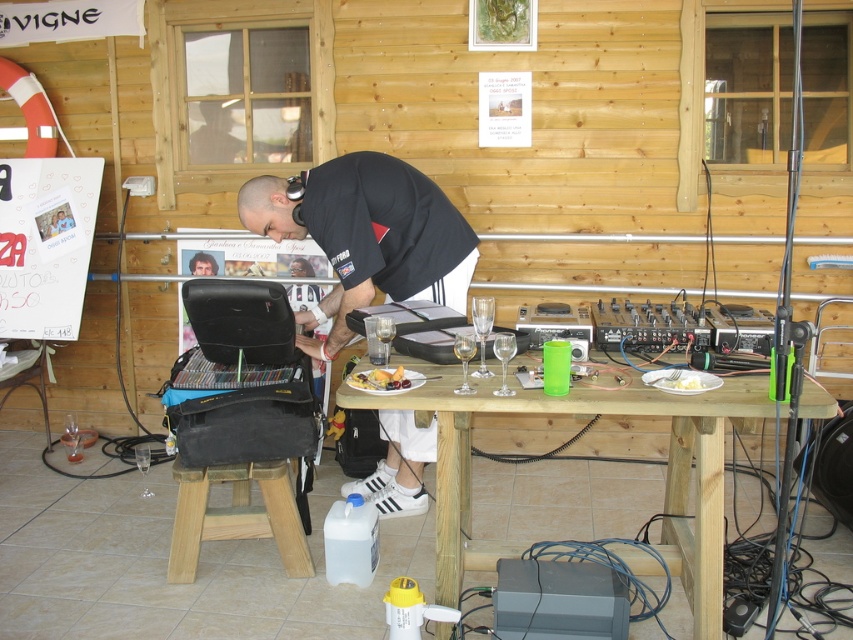
Consider the image. You are a guest at a party held in this cabin and want to place your phone on an empty spot on the wooden table at center. However, you notice the smooth yellow cake at center nearby. Is there enough space between them to place your phone without disturbing the cake?

The wooden table at center and smooth yellow cake at center are 18.78 inches apart from each other. Since 18.78 inches is a considerable distance, there is enough space to place your phone between them without disturbing the cake.

You are a guest at a party held in this cabin. You want to place your phone on the wooden table at center without it falling off. Considering the smooth yellow cake at center is already on the table, where should you place your phone?

Since the wooden table at center is taller than the smooth yellow cake at center, you should place your phone on the wooden table at center away from the edge to ensure it stays stable and doesn